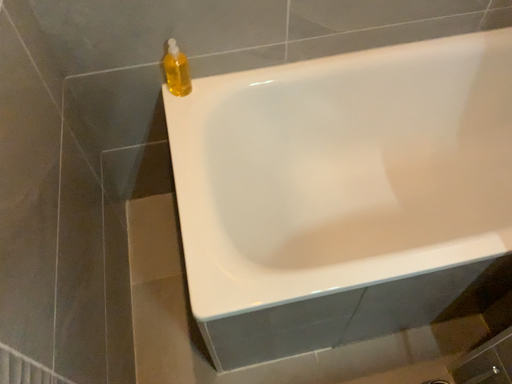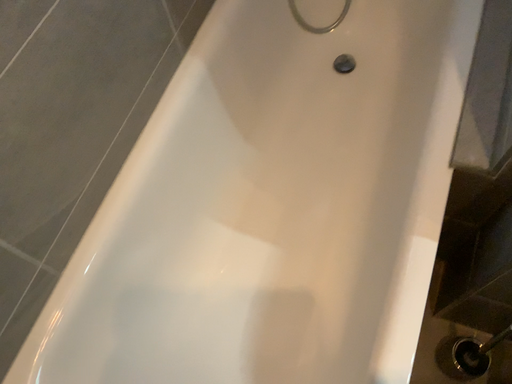
Question: How did the camera likely rotate when shooting the video?

Choices:
 (A) rotated left
 (B) rotated right

Answer: (B)